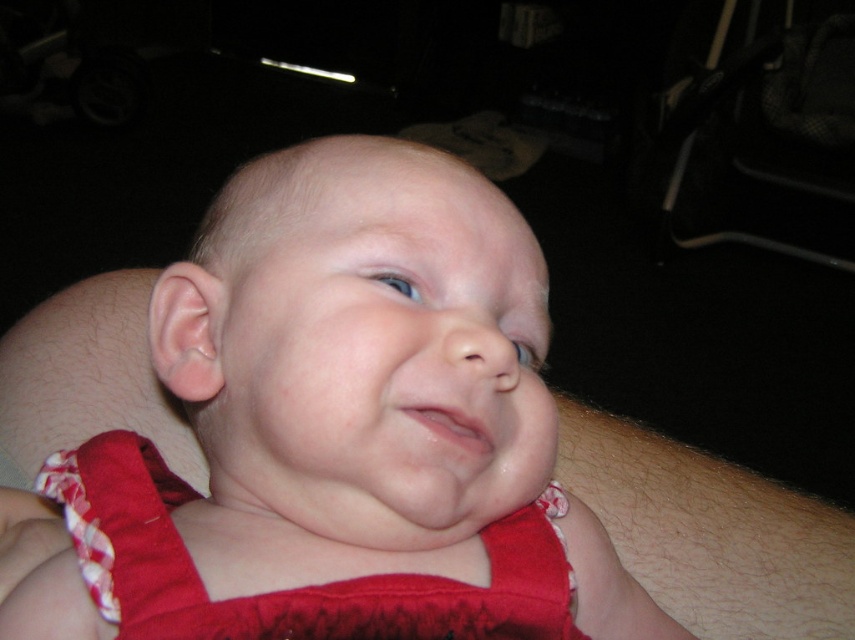
You are a photographer trying to decide whether to adjust the lighting for a baby photo shoot. The scene shows a red fabric baby at center and a red satin dress at center. Based on their sizes, which object would require more space in the frame to ensure it is fully visible?

The red fabric baby at center might be wider than red satin dress at center, so it would require more space in the frame to ensure it is fully visible.

You are a photographer trying to capture a clear shot of the baby. The red fabric baby at center and the red satin dress at center are both in the frame. Which object is closer to the camera?

The red fabric baby at center is positioned over the red satin dress at center, so the baby is closer to the camera than the dress.